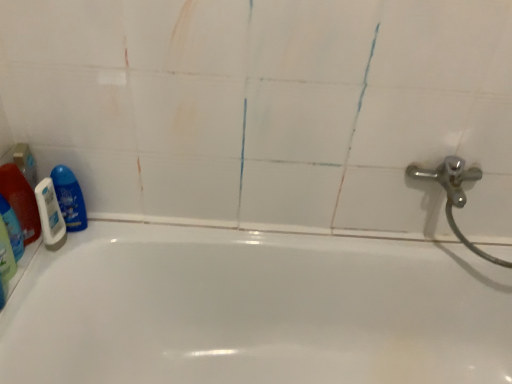
Question: Is white matte shaving cream at left surrounded by translucent plastic bottle at left, which appears as the 2th cleaning product when viewed from the right?

Choices:
 (A) no
 (B) yes

Answer: (A)

Question: Considering the relative sizes of translucent plastic bottle at left, positioned as the second cleaning product in left-to-right order, and white matte shaving cream at left in the image provided, is translucent plastic bottle at left, positioned as the second cleaning product in left-to-right order, shorter than white matte shaving cream at left?

Choices:
 (A) no
 (B) yes

Answer: (A)

Question: Considering the relative sizes of translucent plastic bottle at left, which appears as the 2th cleaning product when viewed from the right, and white matte shaving cream at left in the image provided, is translucent plastic bottle at left, which appears as the 2th cleaning product when viewed from the right, smaller than white matte shaving cream at left?

Choices:
 (A) no
 (B) yes

Answer: (A)

Question: From the image's perspective, is translucent plastic bottle at left, positioned as the second cleaning product in left-to-right order, under white matte shaving cream at left?

Choices:
 (A) no
 (B) yes

Answer: (A)

Question: Is translucent plastic bottle at left, which appears as the 2th cleaning product when viewed from the right, next to white matte shaving cream at left and touching it?

Choices:
 (A) yes
 (B) no

Answer: (A)

Question: From the image's perspective, relative to white matte shaving cream at left, is white glossy bathtub at center above or below?

Choices:
 (A) above
 (B) below

Answer: (B)

Question: Would you say white glossy bathtub at center is inside or outside white matte shaving cream at left?

Choices:
 (A) outside
 (B) inside

Answer: (A)

Question: Visually, is white glossy bathtub at center positioned to the left or to the right of white matte shaving cream at left?

Choices:
 (A) left
 (B) right

Answer: (B)

Question: From a real-world perspective, is white glossy bathtub at center physically located above or below white matte shaving cream at left?

Choices:
 (A) below
 (B) above

Answer: (A)

Question: Would you say white glossy bathtub at center is to the left or to the right of translucent plastic bottle at left, positioned as the second cleaning product in left-to-right order, in the picture?

Choices:
 (A) right
 (B) left

Answer: (A)

Question: In terms of height, does white glossy bathtub at center look taller or shorter compared to translucent plastic bottle at left, which appears as the 2th cleaning product when viewed from the right?

Choices:
 (A) short
 (B) tall

Answer: (B)

Question: Considering the positions of point (133, 288) and point (37, 236), is point (133, 288) closer or farther from the camera than point (37, 236)?

Choices:
 (A) closer
 (B) farther

Answer: (B)

Question: Based on their sizes in the image, would you say white glossy bathtub at center is bigger or smaller than translucent plastic bottle at left, positioned as the second cleaning product in left-to-right order?

Choices:
 (A) big
 (B) small

Answer: (A)

Question: Visually, is white matte shaving cream at left positioned to the left or to the right of blue glossy bottle at left, which ranks as the third cleaning product in left-to-right order?

Choices:
 (A) left
 (B) right

Answer: (A)

Question: From the image's perspective, is white matte shaving cream at left positioned above or below blue glossy bottle at left, which ranks as the third cleaning product in left-to-right order?

Choices:
 (A) below
 (B) above

Answer: (A)